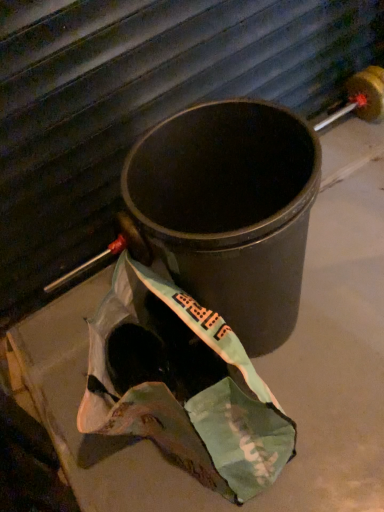
Question: From a real-world perspective, is black matte trash can at center below teal fabric grocery bag at center?

Choices:
 (A) yes
 (B) no

Answer: (B)

Question: Is black matte trash can at center taller than teal fabric grocery bag at center?

Choices:
 (A) yes
 (B) no

Answer: (A)

Question: Does black matte trash can at center lie in front of teal fabric grocery bag at center?

Choices:
 (A) no
 (B) yes

Answer: (A)

Question: Are black matte trash can at center and teal fabric grocery bag at center making contact?

Choices:
 (A) yes
 (B) no

Answer: (B)

Question: Can you confirm if black matte trash can at center is bigger than teal fabric grocery bag at center?

Choices:
 (A) yes
 (B) no

Answer: (A)

Question: Is black matte trash can at center positioned with its back to teal fabric grocery bag at center?

Choices:
 (A) no
 (B) yes

Answer: (A)

Question: Considering the relative sizes of teal fabric grocery bag at center and black matte trash can at center in the image provided, is teal fabric grocery bag at center thinner than black matte trash can at center?

Choices:
 (A) no
 (B) yes

Answer: (B)

Question: Is teal fabric grocery bag at center wider than black matte trash can at center?

Choices:
 (A) yes
 (B) no

Answer: (B)

Question: Is teal fabric grocery bag at center directly adjacent to black matte trash can at center?

Choices:
 (A) no
 (B) yes

Answer: (A)

Question: Does teal fabric grocery bag at center turn towards black matte trash can at center?

Choices:
 (A) yes
 (B) no

Answer: (A)

Question: Does teal fabric grocery bag at center have a larger size compared to black matte trash can at center?

Choices:
 (A) yes
 (B) no

Answer: (B)

Question: Considering the relative positions of teal fabric grocery bag at center and black matte trash can at center in the image provided, is teal fabric grocery bag at center to the right of black matte trash can at center from the viewer's perspective?

Choices:
 (A) no
 (B) yes

Answer: (A)

Question: Considering the positions of point (289, 148) and point (152, 352), is point (289, 148) closer or farther from the camera than point (152, 352)?

Choices:
 (A) farther
 (B) closer

Answer: (B)